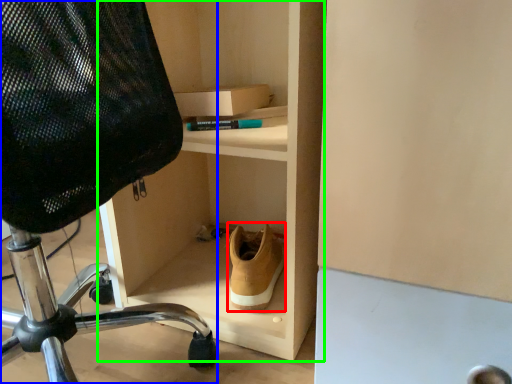
Question: Which object is the farthest from shoe (highlighted by a red box)? Choose among these: chair (highlighted by a blue box) or shelf (highlighted by a green box).

Choices:
 (A) chair
 (B) shelf

Answer: (A)